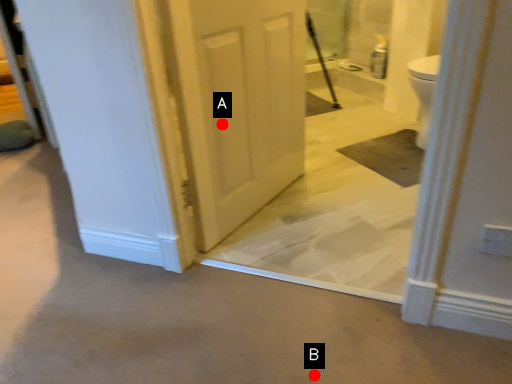
Question: Two points are circled on the image, labeled by A and B beside each circle. Which point is further to the camera?

Choices:
 (A) A is further
 (B) B is further

Answer: (A)